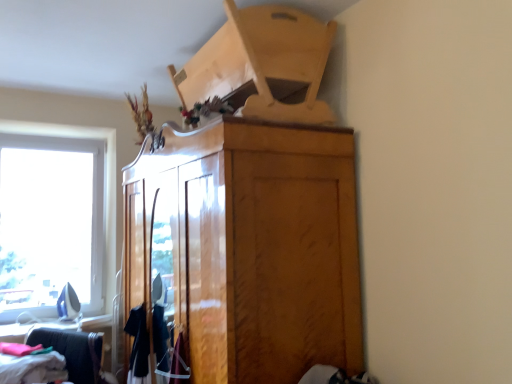
Question: Is soft cotton clothes at lower left, which is counted as the 1th clothing, starting from the left, to the right of velvet burgundy dress at lower center, acting as the first clothing starting from the right, from the viewer's perspective?

Choices:
 (A) no
 (B) yes

Answer: (A)

Question: Does soft cotton clothes at lower left, which is counted as the 1th clothing, starting from the left, have a larger size compared to velvet burgundy dress at lower center, acting as the first clothing starting from the right?

Choices:
 (A) yes
 (B) no

Answer: (A)

Question: Is soft cotton clothes at lower left, which appears as the 3th clothing when viewed from the right, beside velvet burgundy dress at lower center, acting as the first clothing starting from the right?

Choices:
 (A) no
 (B) yes

Answer: (A)

Question: Is soft cotton clothes at lower left, which appears as the 3th clothing when viewed from the right, facing away from velvet burgundy dress at lower center, arranged as the third clothing when viewed from the left?

Choices:
 (A) yes
 (B) no

Answer: (B)

Question: Is soft cotton clothes at lower left, which is counted as the 1th clothing, starting from the left, shorter than velvet burgundy dress at lower center, arranged as the third clothing when viewed from the left?

Choices:
 (A) no
 (B) yes

Answer: (B)

Question: Is soft cotton clothes at lower left, which appears as the 3th clothing when viewed from the right, not inside velvet burgundy dress at lower center, acting as the first clothing starting from the right?

Choices:
 (A) yes
 (B) no

Answer: (A)

Question: From the image's perspective, is velvet burgundy dress at lower center, arranged as the third clothing when viewed from the left, beneath matte black clothing at lower left?

Choices:
 (A) yes
 (B) no

Answer: (B)

Question: Is velvet burgundy dress at lower center, arranged as the third clothing when viewed from the left, taller than matte black clothing at lower left?

Choices:
 (A) yes
 (B) no

Answer: (B)

Question: Is velvet burgundy dress at lower center, arranged as the third clothing when viewed from the left, aimed at matte black clothing at lower left?

Choices:
 (A) yes
 (B) no

Answer: (B)

Question: Is velvet burgundy dress at lower center, arranged as the third clothing when viewed from the left, in front of matte black clothing at lower left?

Choices:
 (A) no
 (B) yes

Answer: (B)

Question: Is velvet burgundy dress at lower center, acting as the first clothing starting from the right, turned away from matte black clothing at lower left?

Choices:
 (A) yes
 (B) no

Answer: (B)

Question: Could matte black clothing at lower left be considered to be inside velvet burgundy dress at lower center, arranged as the third clothing when viewed from the left?

Choices:
 (A) no
 (B) yes

Answer: (A)

Question: Does velvet burgundy dress at lower center, acting as the first clothing starting from the right, have a greater height compared to glossy wood cabinet at center?

Choices:
 (A) yes
 (B) no

Answer: (B)